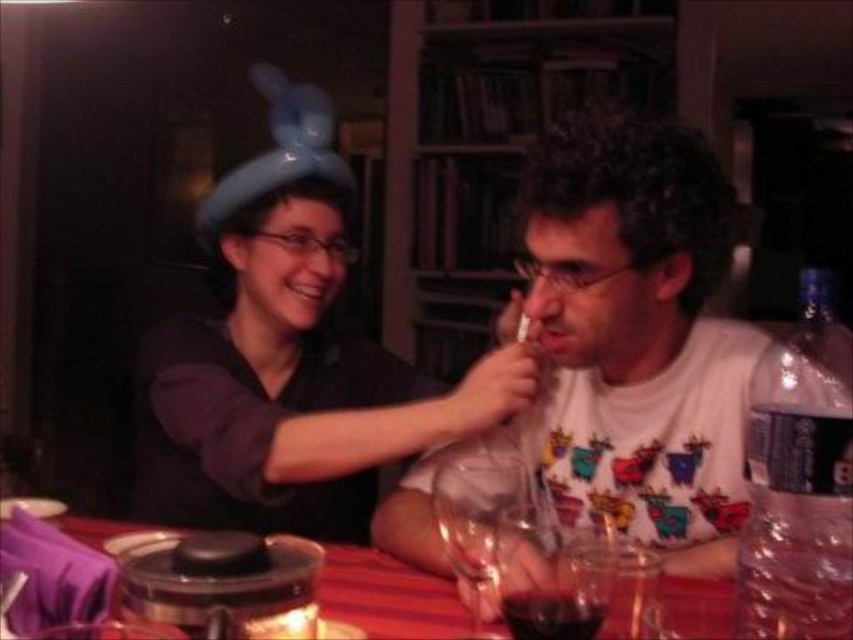
Between clear plastic bottle at right and red plastic table at center, which one is positioned higher?

Positioned higher is clear plastic bottle at right.

Does clear plastic bottle at right have a lesser width compared to red plastic table at center?

Correct, clear plastic bottle at right's width is less than red plastic table at center's.

Image resolution: width=853 pixels, height=640 pixels. Find the location of `clear plastic bottle at right`. clear plastic bottle at right is located at coordinates (801, 484).

This screenshot has height=640, width=853. Find the location of `clear plastic bottle at right`. clear plastic bottle at right is located at coordinates (801, 484).

Is clear plastic bottle at right shorter than dark red liquid at glass center?

Incorrect, clear plastic bottle at right's height does not fall short of dark red liquid at glass center's.

What do you see at coordinates (801, 484) in the screenshot? Image resolution: width=853 pixels, height=640 pixels. I see `clear plastic bottle at right` at bounding box center [801, 484].

Where is `clear plastic bottle at right`? This screenshot has width=853, height=640. clear plastic bottle at right is located at coordinates (801, 484).

Does white matte shirt at center appear over transparent glass wine at center?

Correct, white matte shirt at center is located above transparent glass wine at center.

Find the location of `white matte shirt at center`. white matte shirt at center is located at coordinates (643, 337).